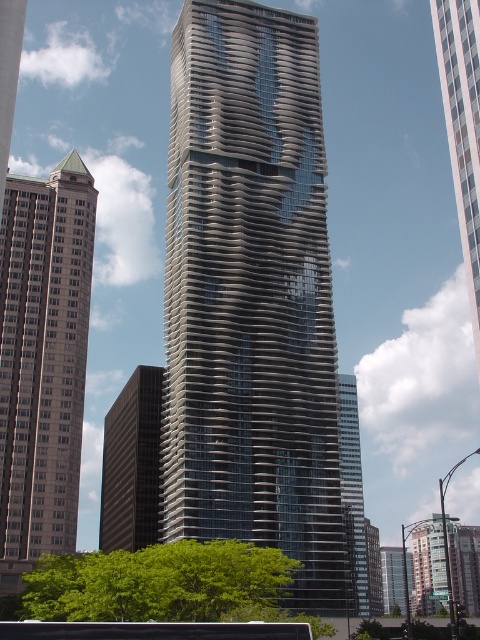
Is gray concrete skyscraper at center closer to camera compared to beige stone building at left?

No, it is not.

Can you confirm if gray concrete skyscraper at center is positioned above beige stone building at left?

Yes.

Which is in front, point (303, 150) or point (64, 449)?

Point (64, 449)

Where is `gray concrete skyscraper at center`? gray concrete skyscraper at center is located at coordinates (251, 296).

Can you confirm if gray concrete skyscraper at center is bigger than glassy reflective skyscraper at right?

No, gray concrete skyscraper at center is not bigger than glassy reflective skyscraper at right.

Who is taller, gray concrete skyscraper at center or glassy reflective skyscraper at right?

gray concrete skyscraper at center

Between point (304, 163) and point (454, 8), which one is positioned behind?

Point (304, 163)

Identify the location of gray concrete skyscraper at center. (251, 296).

Who is more forward, (x=16, y=340) or (x=344, y=524)?

Point (x=16, y=340)

Does point (62, 488) come farther from viewer compared to point (340, 394)?

No, (62, 488) is closer to viewer.

This screenshot has width=480, height=640. Identify the location of beige stone building at left. (43, 360).